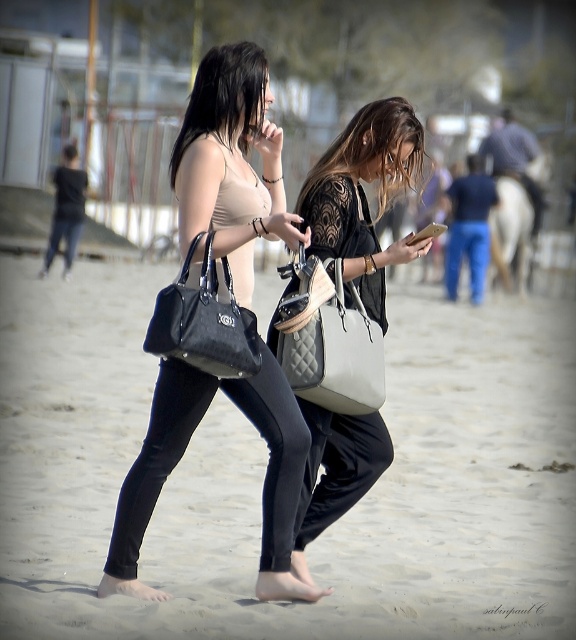
Question: Which object is positioned farthest from the black leather handbag at center-left?

Choices:
 (A) matte black phone at center
 (B) matte black handbag at left
 (C) matte black purse at center
 (D) matte black tank top at upper center

Answer: (A)

Question: Which object is the farthest from the matte black tank top at upper center?

Choices:
 (A) black quilted purse at center
 (B) quilted leather handbag at center
 (C) matte black phone at center

Answer: (C)

Question: Can you confirm if sandy beach at center is positioned to the right of matte black handbag at left?

Choices:
 (A) no
 (B) yes

Answer: (B)

Question: Estimate the real-world distances between objects in this image. Which object is farther from the matte black purse at center?

Choices:
 (A) matte black handbag at left
 (B) black leather handbag at center-left
 (C) matte black tank top at upper center
 (D) matte black phone at center

Answer: (B)

Question: Can you confirm if sandy beach at center is positioned above black quilted purse at center?

Choices:
 (A) yes
 (B) no

Answer: (B)

Question: Is matte black purse at center to the left of matte black phone at center from the viewer's perspective?

Choices:
 (A) yes
 (B) no

Answer: (A)